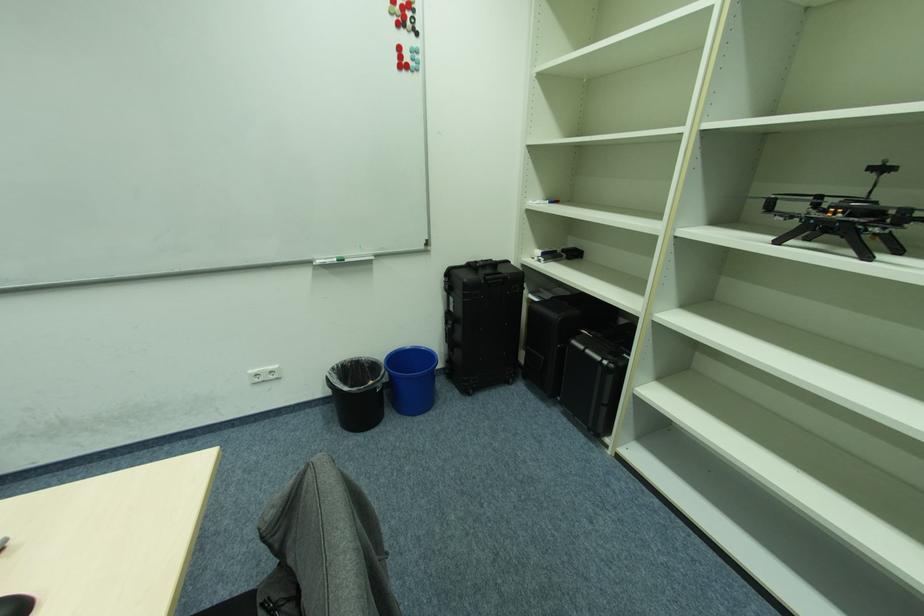
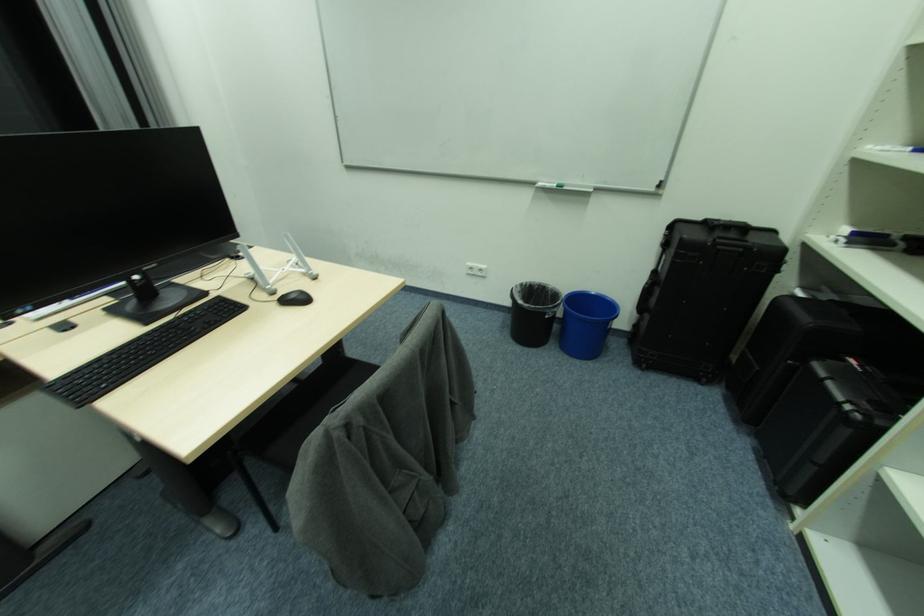
Question: The camera is either moving clockwise (left) or counter-clockwise (right) around the object. The first image is from the beginning of the video and the second image is from the end. Is the camera moving left or right when shooting the video?

Choices:
 (A) Left
 (B) Right

Answer: (B)